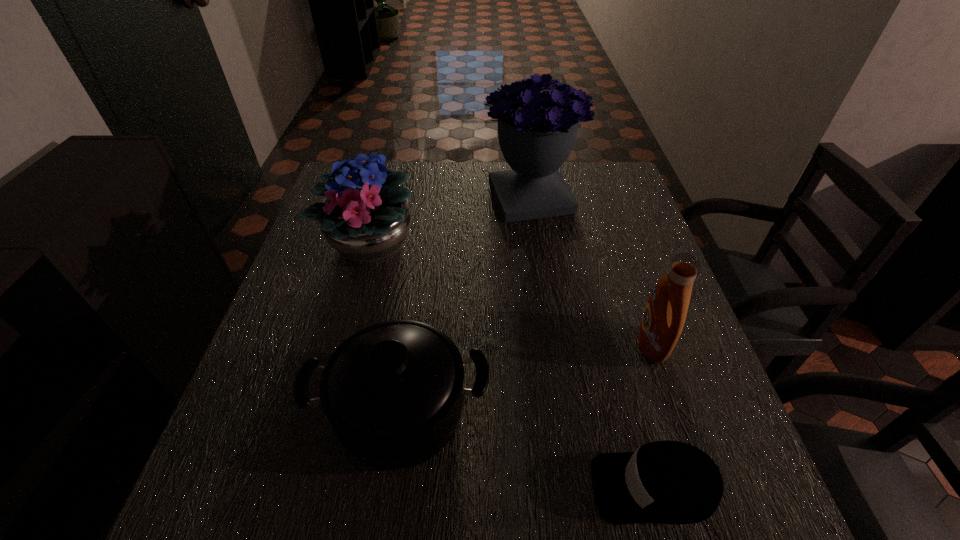
Find the location of a particular element. bouquet located in the right edge section of the desktop is located at coordinates (537, 130).

This screenshot has width=960, height=540. In order to click on detergent that is at the right edge in this screenshot , I will do `click(664, 316)`.

Locate an element on the screen. cap present at the right edge is located at coordinates (667, 482).

You are a GUI agent. You are given a task and a screenshot of the screen. Output one action in this format:
    pyautogui.click(x=<x>, y=<y>)
    Task: Click on the object that is at the near left corner
    This screenshot has width=960, height=540.
    Given the screenshot: What is the action you would take?
    pyautogui.click(x=393, y=392)

Where is `object situated at the far right corner`? Image resolution: width=960 pixels, height=540 pixels. object situated at the far right corner is located at coordinates (537, 130).

This screenshot has height=540, width=960. Identify the location of object that is at the near right corner. (667, 482).

Find the location of `free space at the far edge of the desktop`. free space at the far edge of the desktop is located at coordinates (460, 202).

Find the location of a particular element. vacant space at the left edge of the desktop is located at coordinates (230, 469).

Locate an element on the screen. vacant space at the right edge of the desktop is located at coordinates tap(636, 277).

In the image, there is a desktop. Where is `vacant area at the far right corner`? vacant area at the far right corner is located at coordinates (590, 165).